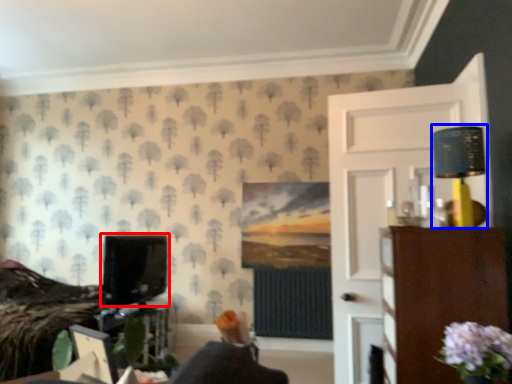
Question: Which object appears closest to the camera in this image, computer monitor (highlighted by a red box) or table lamp (highlighted by a blue box)?

Choices:
 (A) computer monitor
 (B) table lamp

Answer: (B)